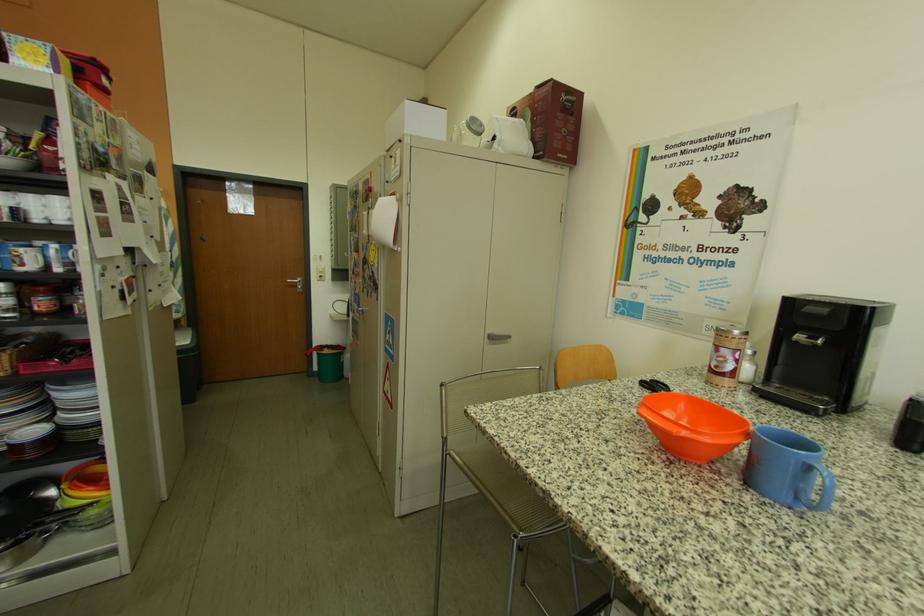
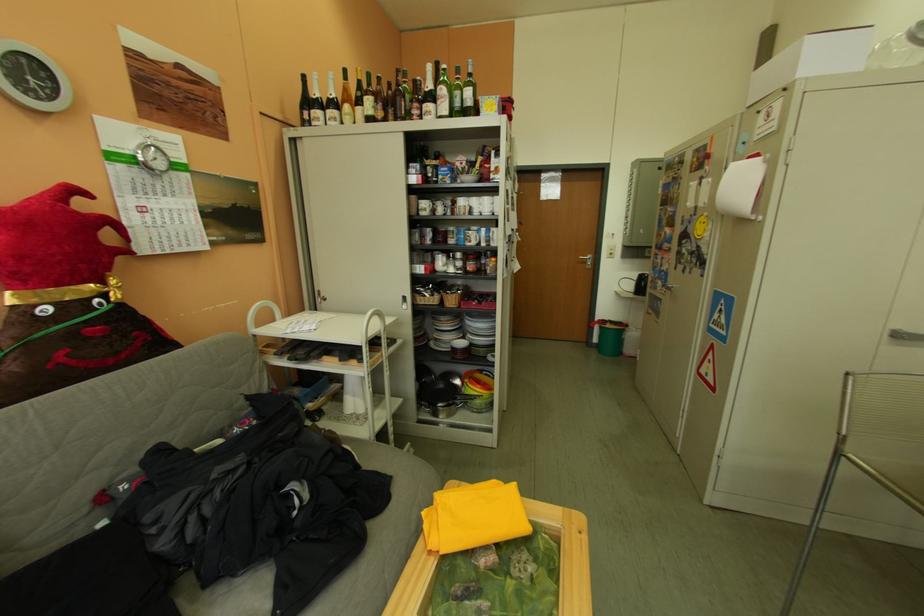
Where in the second image is the point corresponding to the point at 79,525 from the first image?

(478, 405)